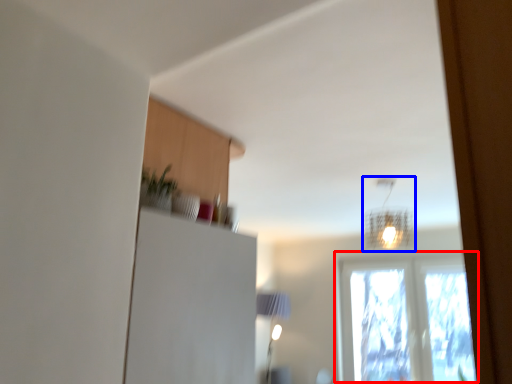
Question: Which object is further to the camera taking this photo, window (highlighted by a red box) or lamp (highlighted by a blue box)?

Choices:
 (A) window
 (B) lamp

Answer: (A)